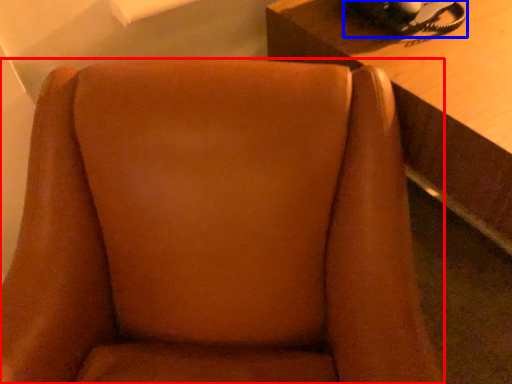
Question: Which object is closer to the camera taking this photo, chair (highlighted by a red box) or corded phone (highlighted by a blue box)?

Choices:
 (A) chair
 (B) corded phone

Answer: (A)